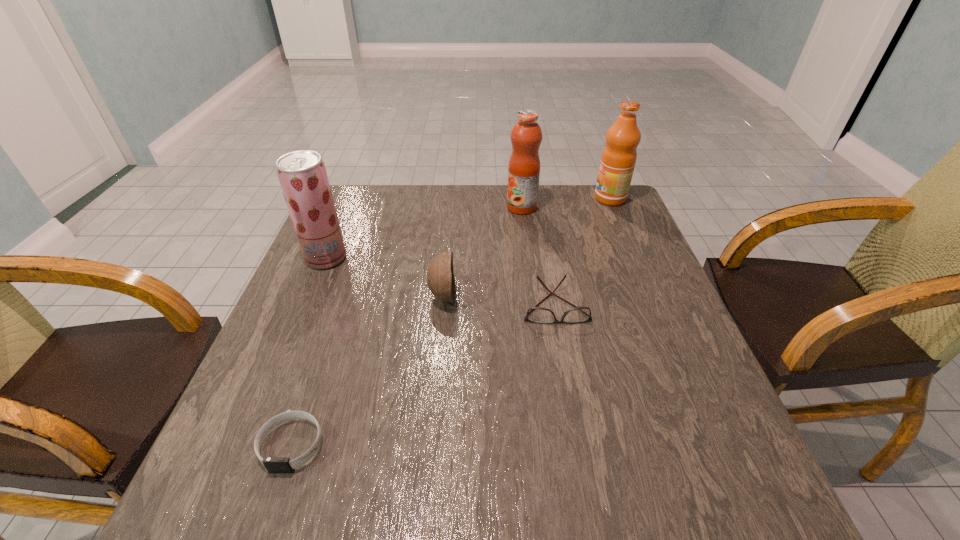
Image resolution: width=960 pixels, height=540 pixels. I want to click on the rightmost fruit juice, so (x=618, y=159).

Where is `the second fruit juice from right to left`? This screenshot has height=540, width=960. the second fruit juice from right to left is located at coordinates (526, 136).

Image resolution: width=960 pixels, height=540 pixels. Identify the location of the leftmost fruit juice. (302, 174).

Locate an element on the screen. the fourth nearest object is located at coordinates (302, 174).

At what (x,y) coordinates should I click in order to perform the action: click on the third shortest object. Please return your answer as a coordinate pair (x, y). Looking at the image, I should click on (440, 277).

You are a GUI agent. You are given a task and a screenshot of the screen. Output one action in this format:
    pyautogui.click(x=<x>, y=<y>)
    Task: Click on the bowl
    The width and height of the screenshot is (960, 540).
    Given the screenshot: What is the action you would take?
    pyautogui.click(x=440, y=277)

The height and width of the screenshot is (540, 960). I want to click on spectacles, so click(x=535, y=314).

You are a GUI agent. You are given a task and a screenshot of the screen. Output one action in this format:
    pyautogui.click(x=<x>, y=<y>)
    Task: Click on the nearest object
    
    Given the screenshot: What is the action you would take?
    pyautogui.click(x=273, y=464)

This screenshot has width=960, height=540. Identify the location of vacant space located 0.250m on the label side of the rightmost object. (515, 199).

The width and height of the screenshot is (960, 540). Find the location of `free space located 0.390m on the label side of the rightmost object`. free space located 0.390m on the label side of the rightmost object is located at coordinates (470, 199).